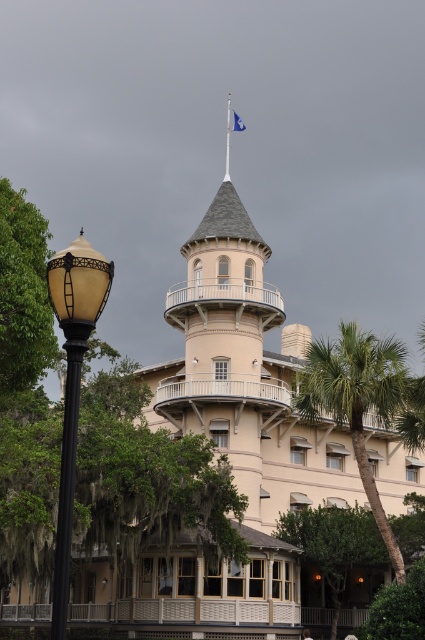
Question: Can you confirm if green leafy palm tree at center is wider than green leafy tree at left?

Choices:
 (A) yes
 (B) no

Answer: (A)

Question: Does green leafy palm tree at center appear on the right side of blue fabric flag at top?

Choices:
 (A) no
 (B) yes

Answer: (B)

Question: Which point is farther from the camera taking this photo?

Choices:
 (A) (229, 97)
 (B) (237, 116)

Answer: (A)

Question: Which of the following is the closest to the observer?

Choices:
 (A) (113, 502)
 (B) (229, 93)

Answer: (A)

Question: Where is matte black lamp post at left located in relation to black polished metal pole at left in the image?

Choices:
 (A) below
 (B) above

Answer: (B)

Question: Among these objects, which one is nearest to the camera?

Choices:
 (A) green mossy tree at lower left
 (B) matte black lamp post at left
 (C) green leafy palm tree at center
 (D) black polished metal pole at left

Answer: (D)